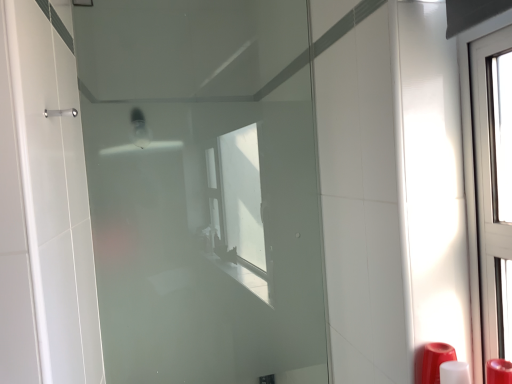
Where is `frosted glass door at center`? This screenshot has height=384, width=512. frosted glass door at center is located at coordinates (203, 190).

Measure the distance between point (135, 87) and camera.

1.26 meters.

What do you see at coordinates (203, 190) in the screenshot? I see `frosted glass door at center` at bounding box center [203, 190].

Image resolution: width=512 pixels, height=384 pixels. I want to click on red plastic soap dispenser at lower right, so click(499, 371).

What do you see at coordinates (499, 371) in the screenshot? This screenshot has height=384, width=512. I see `red plastic soap dispenser at lower right` at bounding box center [499, 371].

Locate an element on the screen. The height and width of the screenshot is (384, 512). frosted glass door at center is located at coordinates (203, 190).

Is frosted glass door at center to the left or to the right of red plastic soap dispenser at lower right in the image?

frosted glass door at center is positioned on red plastic soap dispenser at lower right's left side.

Is frosted glass door at center in front of or behind red plastic soap dispenser at lower right in the image?

frosted glass door at center is positioned farther from the viewer than red plastic soap dispenser at lower right.

Considering the points (179, 193) and (500, 371), which point is in front, point (179, 193) or point (500, 371)?

The point (500, 371) is closer.

From the image's perspective, relative to red plastic soap dispenser at lower right, is frosted glass door at center above or below?

Clearly, from the image's perspective, frosted glass door at center is above red plastic soap dispenser at lower right.

From the picture: From a real-world perspective, between frosted glass door at center and red plastic soap dispenser at lower right, who is vertically higher?

frosted glass door at center is physically above.

Can you confirm if frosted glass door at center is thinner than red plastic soap dispenser at lower right?

Yes.

Considering the relative sizes of frosted glass door at center and red plastic soap dispenser at lower right in the image provided, is frosted glass door at center taller than red plastic soap dispenser at lower right?

Yes.

Does frosted glass door at center have a larger size compared to red plastic soap dispenser at lower right?

Yes.

Does frosted glass door at center contain red plastic soap dispenser at lower right?

No, red plastic soap dispenser at lower right is not a part of frosted glass door at center.

Is there a large distance between frosted glass door at center and red plastic soap dispenser at lower right?

They are positioned close to each other.

Could you tell me if frosted glass door at center is facing red plastic soap dispenser at lower right?

Yes, frosted glass door at center is aimed at red plastic soap dispenser at lower right.

From the picture: How many degrees apart are the facing directions of frosted glass door at center and red plastic soap dispenser at lower right?

The facing directions of frosted glass door at center and red plastic soap dispenser at lower right are 1.14 degrees apart.

Measure the distance from frosted glass door at center to red plastic soap dispenser at lower right.

frosted glass door at center and red plastic soap dispenser at lower right are 34.95 inches apart from each other.

Find the location of a particular element. The height and width of the screenshot is (384, 512). soap dispenser on the right of frosted glass door at center is located at coordinates (499, 371).

Visually, is red plastic soap dispenser at lower right positioned to the left or to the right of frosted glass door at center?

From the image, it's evident that red plastic soap dispenser at lower right is to the right of frosted glass door at center.

Between red plastic soap dispenser at lower right and frosted glass door at center, which one is positioned in front?

Positioned in front is red plastic soap dispenser at lower right.

Considering the points (507, 379) and (116, 328), which point is in front, point (507, 379) or point (116, 328)?

The point (507, 379) is more forward.

From the image's perspective, would you say red plastic soap dispenser at lower right is shown under frosted glass door at center?

Correct, red plastic soap dispenser at lower right appears lower than frosted glass door at center in the image.

From a real-world perspective, is red plastic soap dispenser at lower right beneath frosted glass door at center?

Yes, from a real-world perspective, red plastic soap dispenser at lower right is under frosted glass door at center.

Looking at their sizes, would you say red plastic soap dispenser at lower right is wider or thinner than frosted glass door at center?

Clearly, red plastic soap dispenser at lower right has more width compared to frosted glass door at center.

Between red plastic soap dispenser at lower right and frosted glass door at center, which one has less height?

With less height is red plastic soap dispenser at lower right.

Considering the sizes of objects red plastic soap dispenser at lower right and frosted glass door at center in the image provided, who is smaller, red plastic soap dispenser at lower right or frosted glass door at center?

Smaller between the two is red plastic soap dispenser at lower right.

Is red plastic soap dispenser at lower right not within frosted glass door at center?

Yes, red plastic soap dispenser at lower right is outside of frosted glass door at center.

Are red plastic soap dispenser at lower right and frosted glass door at center far apart?

red plastic soap dispenser at lower right is near frosted glass door at center, not far away.

Is red plastic soap dispenser at lower right oriented towards frosted glass door at center?

No, red plastic soap dispenser at lower right is not turned towards frosted glass door at center.

How many degrees apart are the facing directions of red plastic soap dispenser at lower right and frosted glass door at center?

The angular difference between red plastic soap dispenser at lower right and frosted glass door at center is 1.14 degrees.

Where is `door that is above the red plastic soap dispenser at lower right (from a real-world perspective)`? door that is above the red plastic soap dispenser at lower right (from a real-world perspective) is located at coordinates (203, 190).

The width and height of the screenshot is (512, 384). Find the location of `door to the left of red plastic soap dispenser at lower right`. door to the left of red plastic soap dispenser at lower right is located at coordinates (203, 190).

Locate an element on the screen. This screenshot has height=384, width=512. soap dispenser located underneath the frosted glass door at center (from a real-world perspective) is located at coordinates (499, 371).